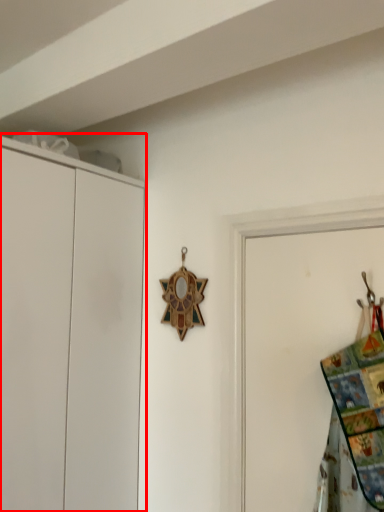
Question: From the image's perspective, what is the correct spatial relationship of cupboard (annotated by the red box) in relation to blanket?

Choices:
 (A) above
 (B) below

Answer: (B)